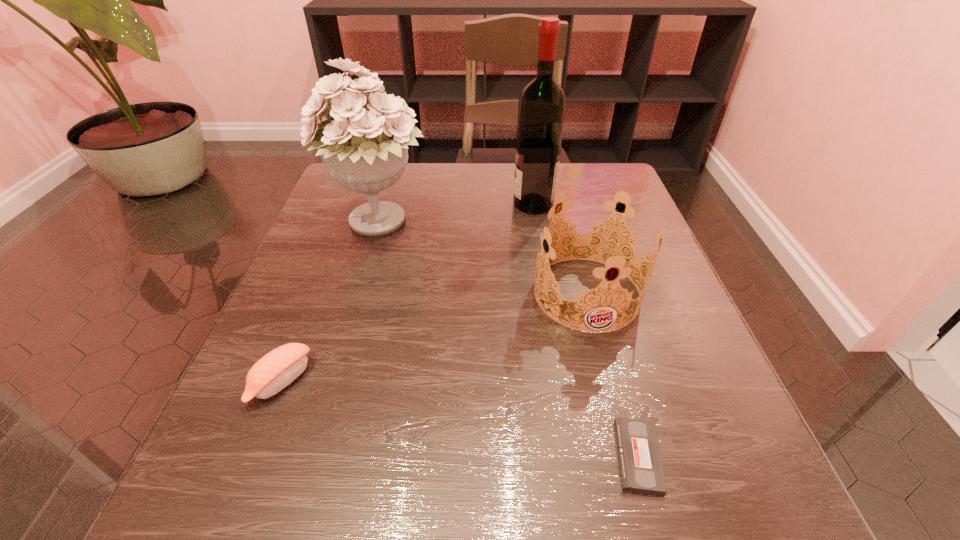
Image resolution: width=960 pixels, height=540 pixels. Find the location of `free space that satisfies the following two spatial constraints: 1. on the front and back of the alcohol; 2. on the right side of the videotape`. free space that satisfies the following two spatial constraints: 1. on the front and back of the alcohol; 2. on the right side of the videotape is located at coordinates (575, 456).

Locate an element on the screen. free location that satisfies the following two spatial constraints: 1. on the front and back of the crown; 2. on the right side of the alcohol is located at coordinates (548, 293).

Find the location of a particular element. This screenshot has height=540, width=960. free space that satisfies the following two spatial constraints: 1. on the front and back of the alcohol; 2. on the back side of the shortest object is located at coordinates (575, 456).

Find the location of a particular element. vacant space that satisfies the following two spatial constraints: 1. on the back side of the second shortest object; 2. on the right side of the bouquet is located at coordinates (344, 224).

Locate an element on the screen. vacant position in the image that satisfies the following two spatial constraints: 1. on the back side of the sushi; 2. on the right side of the bouquet is located at coordinates (344, 224).